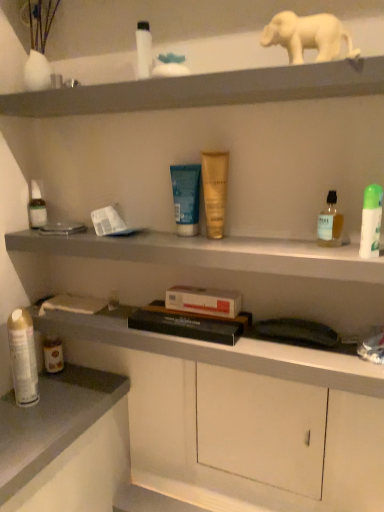
I want to click on empty space that is ontop of smooth gray countertop at lower left (from a real-world perspective), so click(46, 409).